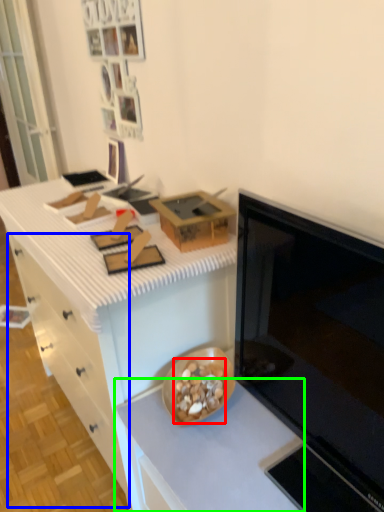
Question: Estimate the real-world distances between objects in this image. Which object is farther from food (highlighted by a red box), drawer (highlighted by a blue box) or countertop (highlighted by a green box)?

Choices:
 (A) drawer
 (B) countertop

Answer: (A)